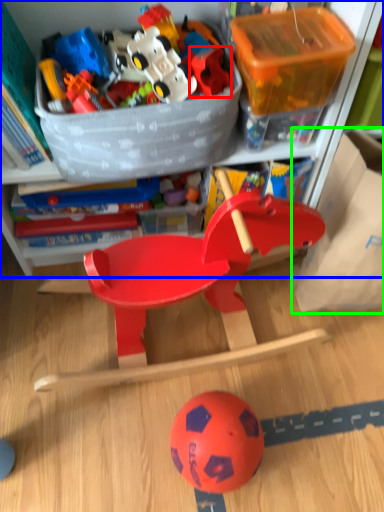
Question: Estimate the real-world distances between objects in this image. Which object is farther from toy (highlighted by a red box), cabinetry (highlighted by a blue box) or storage box (highlighted by a green box)?

Choices:
 (A) cabinetry
 (B) storage box

Answer: (B)